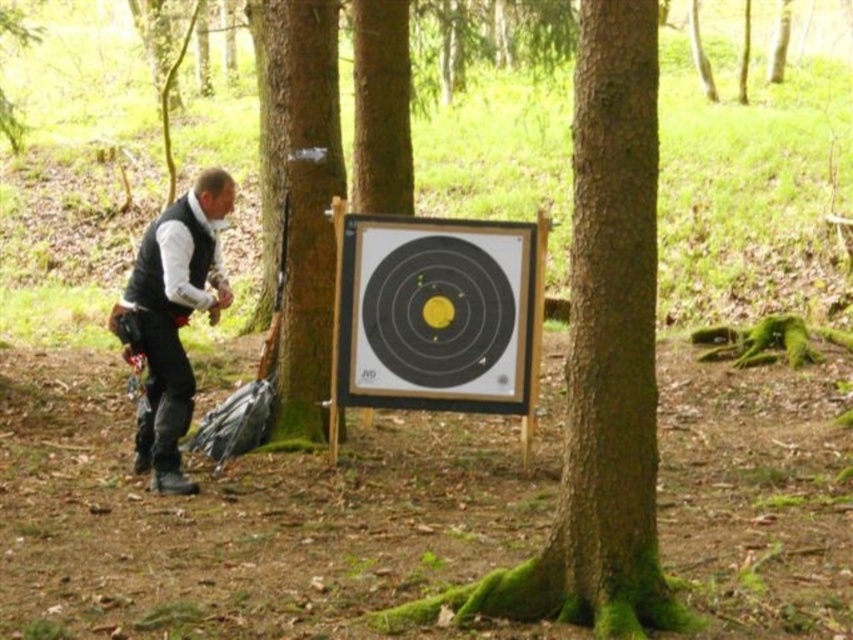
Question: Does green mossy tree at center come behind black matte vest at left?

Choices:
 (A) yes
 (B) no

Answer: (B)

Question: Which of the following is the closest to the observer?

Choices:
 (A) black matte vest at left
 (B) green mossy tree at center

Answer: (B)

Question: Which of the following is the farthest from the observer?

Choices:
 (A) black matte vest at left
 (B) green mossy tree at center

Answer: (A)

Question: Does green mossy tree at center appear under black matte vest at left?

Choices:
 (A) no
 (B) yes

Answer: (A)

Question: Does green mossy tree at center appear on the right side of black matte vest at left?

Choices:
 (A) no
 (B) yes

Answer: (B)